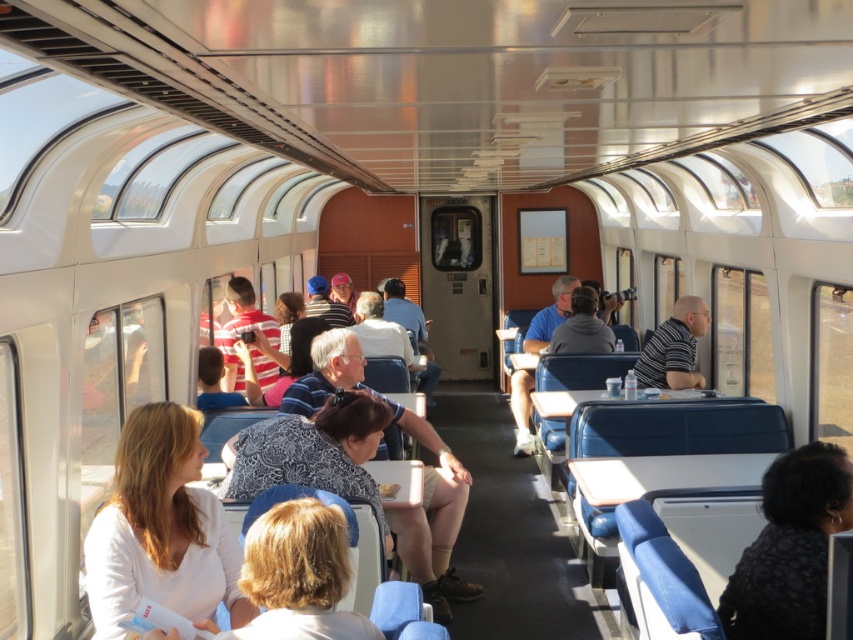
Who is more forward, (727, 582) or (697, 300)?

Point (727, 582) is more forward.

At what (x,y) coordinates should I click in order to perform the action: click on black textured shirt at lower right. Please return your answer as a coordinate pair (x, y). This screenshot has width=853, height=640. Looking at the image, I should click on (790, 547).

Which is in front, point (165, 579) or point (752, 554)?

Point (165, 579)

Does point (231, 593) come closer to viewer compared to point (776, 592)?

Yes, it is in front of point (776, 592).

Where is `white matte shirt at lower left`? white matte shirt at lower left is located at coordinates (161, 528).

Which is in front, point (201, 586) or point (634, 371)?

Point (201, 586)

Does white matte shirt at lower left have a greater width compared to striped cotton shirt at center?

No, white matte shirt at lower left is not wider than striped cotton shirt at center.

Find the location of a particular element. Image resolution: width=853 pixels, height=640 pixels. white matte shirt at lower left is located at coordinates (161, 528).